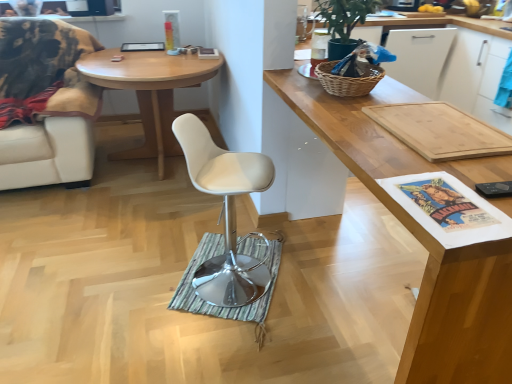
Where is `free space behind green striped mat at center`? The image size is (512, 384). free space behind green striped mat at center is located at coordinates (222, 224).